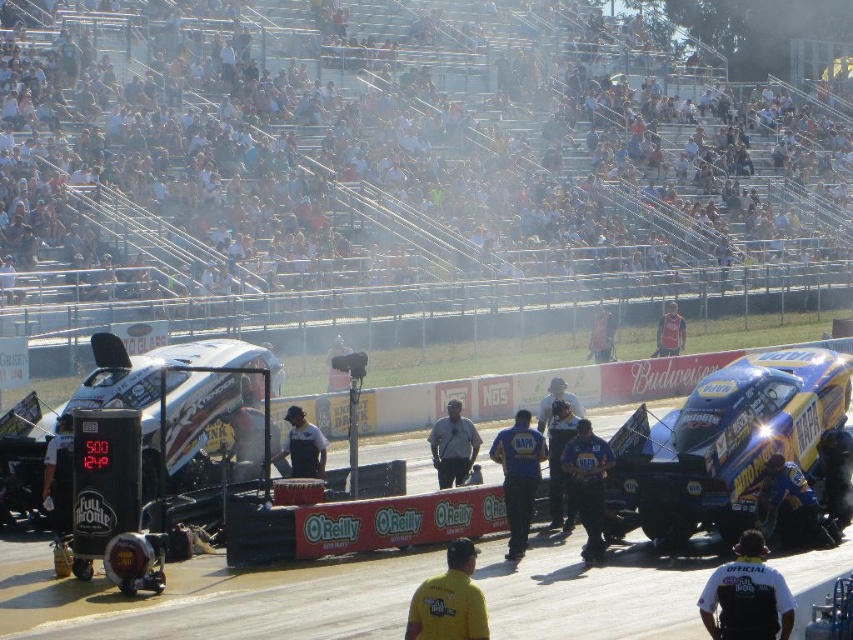
Does point (763, 404) come in front of point (556, 390)?

That is True.

Can you confirm if blue glossy race car at center is smaller than blue metallic helmet at center?

Indeed, blue glossy race car at center has a smaller size compared to blue metallic helmet at center.

What do you see at coordinates (722, 444) in the screenshot?
I see `blue glossy race car at center` at bounding box center [722, 444].

I want to click on blue glossy race car at center, so click(x=722, y=444).

Is blue uniform at center further to the viewer compared to blue metallic helmet at center?

No, it is in front of blue metallic helmet at center.

At what (x,y) coordinates should I click in order to perform the action: click on blue uniform at center. Please return your answer as a coordinate pair (x, y). Image resolution: width=853 pixels, height=640 pixels. Looking at the image, I should click on (518, 476).

Find the location of a particular element. blue uniform at center is located at coordinates (518, 476).

How far apart are gray fabric shirt at center and dark blue shirt at center?

gray fabric shirt at center and dark blue shirt at center are 2.48 meters apart from each other.

Between gray fabric shirt at center and dark blue shirt at center, which one has less height?

With less height is gray fabric shirt at center.

Does point (445, 422) lie behind point (293, 452)?

That is True.

The width and height of the screenshot is (853, 640). What are the coordinates of `gray fabric shirt at center` in the screenshot? It's located at (453, 445).